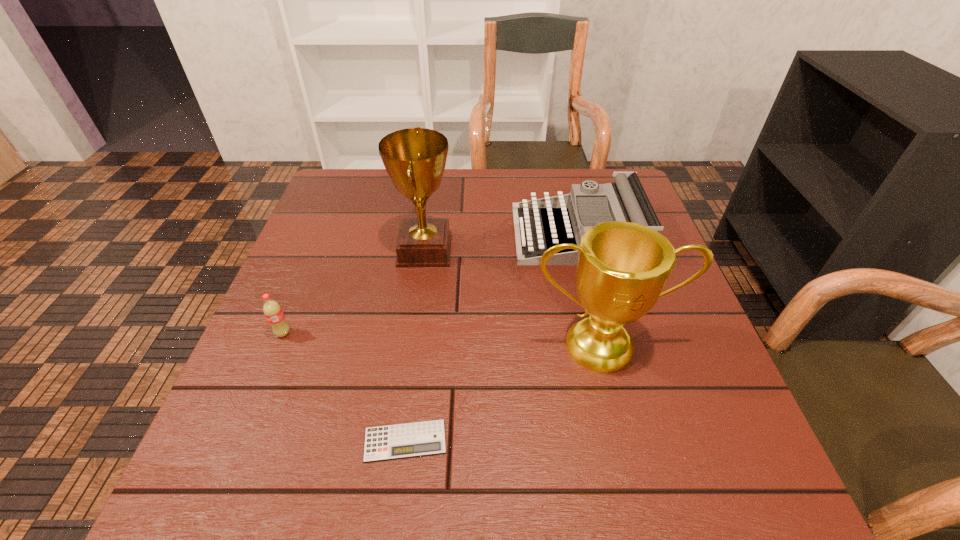
At what (x,y) coordinates should I click in order to perform the action: click on the farther award. Please return your answer as a coordinate pair (x, y). Image resolution: width=960 pixels, height=540 pixels. Looking at the image, I should click on (415, 158).

Find the location of a particular element. This screenshot has width=960, height=540. the right award is located at coordinates pyautogui.click(x=622, y=268).

The height and width of the screenshot is (540, 960). Identify the location of typewriter. (626, 200).

This screenshot has width=960, height=540. In order to click on soda in this screenshot , I will do `click(273, 312)`.

Locate an element on the screen. Image resolution: width=960 pixels, height=540 pixels. the shortest object is located at coordinates (399, 441).

This screenshot has height=540, width=960. I want to click on the nearest object, so click(x=399, y=441).

Find the location of a particular element. The image size is (960, 540). vacant area located on the plaque of the farther award is located at coordinates (609, 250).

Locate an element on the screen. vacant space positioned 0.210m on the shiny surface of the nearer award is located at coordinates (637, 491).

Identify the location of vacant region located 0.230m on the typing side of the typewriter. (427, 234).

Find the location of `free space located on the typing side of the typewriter`. free space located on the typing side of the typewriter is located at coordinates (488, 234).